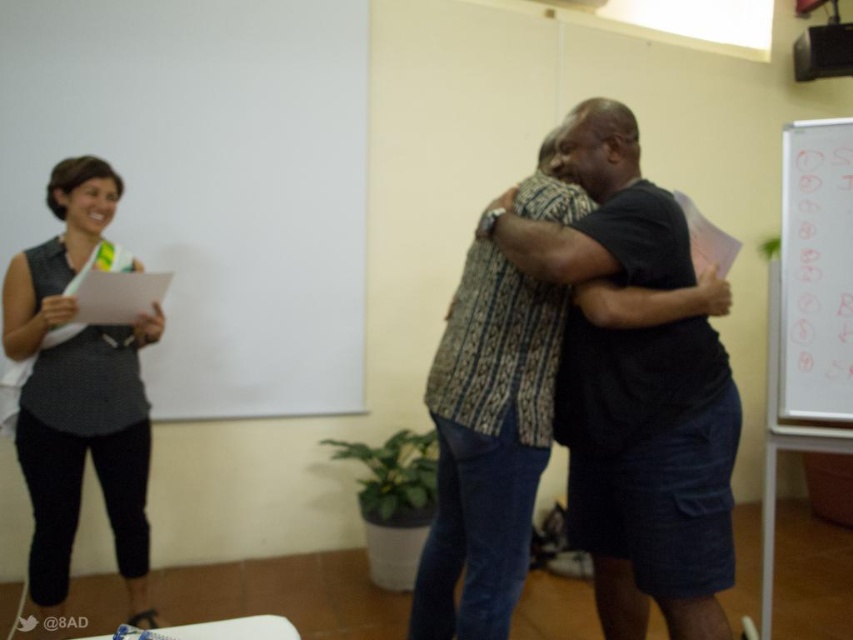
Consider the image. Who is shorter, dark blue textured shorts at center or patterned fabric shirt at center?

patterned fabric shirt at center

Between point (619, 621) and point (471, 298), which one is positioned in front?

Point (471, 298)

Image resolution: width=853 pixels, height=640 pixels. Describe the element at coordinates (650, 472) in the screenshot. I see `dark blue textured shorts at center` at that location.

You are a GUI agent. You are given a task and a screenshot of the screen. Output one action in this format:
    pyautogui.click(x=<x>, y=<y>)
    Task: Click on the dark blue textured shorts at center
    The width and height of the screenshot is (853, 640).
    Given the screenshot: What is the action you would take?
    pyautogui.click(x=650, y=472)

Can you confirm if dark blue textured shorts at center is bigger than whiteboard at right?

Yes.

Is dark blue textured shorts at center thinner than whiteboard at right?

In fact, dark blue textured shorts at center might be wider than whiteboard at right.

Between point (717, 476) and point (781, 332), which one is positioned in front?

Point (717, 476) is in front.

Where is `dark blue textured shorts at center`? The height and width of the screenshot is (640, 853). dark blue textured shorts at center is located at coordinates (650, 472).

The image size is (853, 640). What do you see at coordinates (78, 394) in the screenshot? I see `matte gray shirt at left` at bounding box center [78, 394].

Measure the distance between matte gray shirt at left and whiteboard at right.

They are 6.60 feet apart.

The height and width of the screenshot is (640, 853). In order to click on matte gray shirt at left in this screenshot , I will do `click(78, 394)`.

Find the location of a particular element. This screenshot has width=853, height=640. matte gray shirt at left is located at coordinates (78, 394).